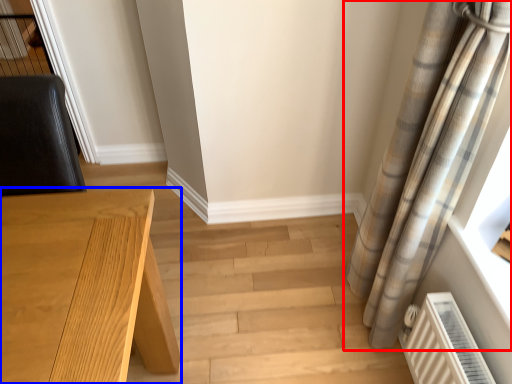
Question: Which of the following is the farthest to the observer, curtain (highlighted by a red box) or table (highlighted by a blue box)?

Choices:
 (A) curtain
 (B) table

Answer: (A)